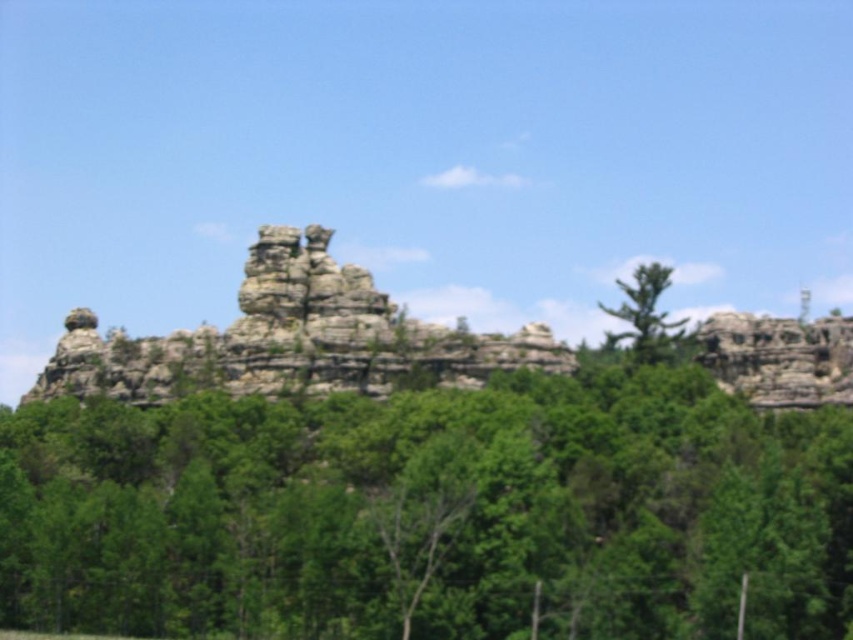
Question: Does green leafy tree at center appear on the left side of rocky cliff at center?

Choices:
 (A) yes
 (B) no

Answer: (B)

Question: Is green leafy tree at center behind rocky cliff at center?

Choices:
 (A) yes
 (B) no

Answer: (B)

Question: Observing the image, what is the correct spatial positioning of rocky cliff at center in reference to green textured tree at upper right?

Choices:
 (A) right
 (B) left

Answer: (B)

Question: Which point is farther to the camera?

Choices:
 (A) (381, 445)
 (B) (666, 280)

Answer: (B)

Question: Which point is farther from the camera taking this photo?

Choices:
 (A) (90, 371)
 (B) (763, 445)
 (C) (654, 275)

Answer: (A)

Question: Which point is farther to the camera?

Choices:
 (A) (425, 509)
 (B) (328, 348)

Answer: (B)